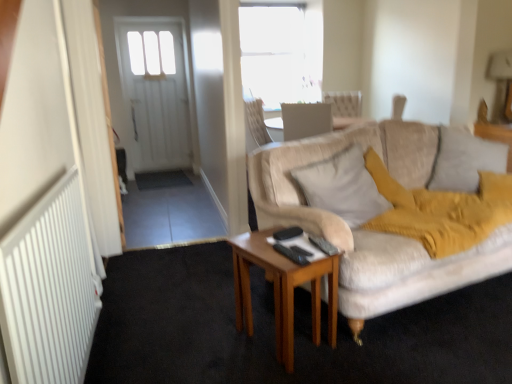
Question: Is wooden table at center inside or outside of black plastic remote control at center, which is the 1th remote control from front to back?

Choices:
 (A) outside
 (B) inside

Answer: (A)

Question: Is point click(266, 246) positioned closer to the camera than point click(302, 256)?

Choices:
 (A) closer
 (B) farther

Answer: (B)

Question: Which of these objects is positioned closest to the light beige fabric pillow at center, which is the second pillow from right to left?

Choices:
 (A) black plastic remote control at center, which is counted as the 2th remote control, starting from the front
 (B) black plastic remote control at center, which appears as the 3th remote control when viewed from the back
 (C) wooden table at center
 (D) black plastic remote control at center, which ranks as the third remote control in front-to-back order
 (E) metallic gold lampshade at upper right

Answer: (D)

Question: Which object is positioned farthest from the black plastic remote control at center, which ranks as the third remote control in front-to-back order?

Choices:
 (A) black plastic remote control at center, which is the 1th remote control from front to back
 (B) wooden table at center
 (C) soft beige pillow at right, which appears as the 1th pillow when viewed from the right
 (D) black plastic remote control at center, which is counted as the 2th remote control, starting from the front
 (E) metallic gold lampshade at upper right

Answer: (E)